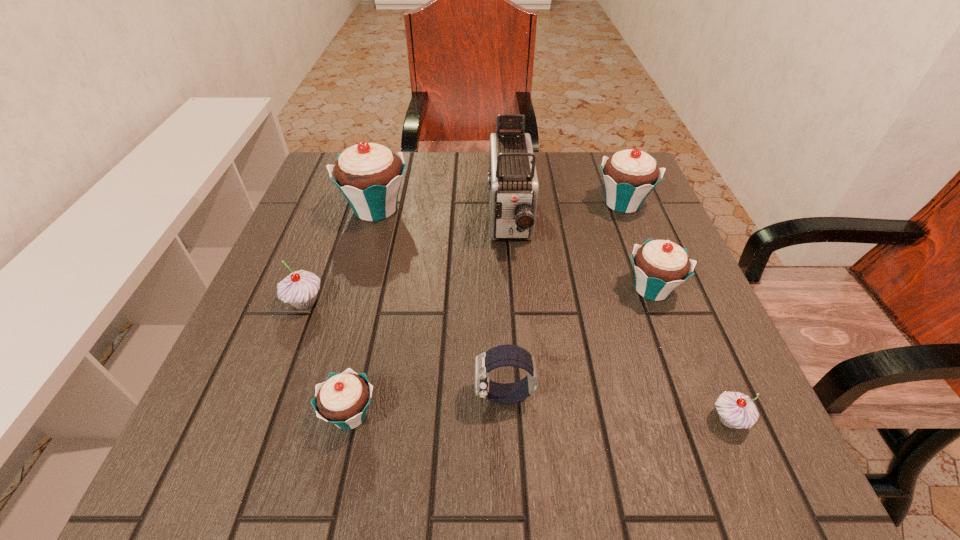
The width and height of the screenshot is (960, 540). What are the coordinates of `vacant space located 0.050m on the left of the right gray cupcake` in the screenshot? It's located at (677, 420).

Find the location of a particular element. This screenshot has height=540, width=960. free space located 0.150m on the left of the nearest teal cupcake is located at coordinates (226, 415).

Locate an element on the screen. This screenshot has width=960, height=540. camcorder that is at the far edge is located at coordinates (513, 187).

The width and height of the screenshot is (960, 540). Identify the location of object located in the far left corner section of the desktop. (369, 175).

The width and height of the screenshot is (960, 540). What are the coordinates of `object positioned at the far right corner` in the screenshot? It's located at (629, 176).

Identify the location of object present at the near right corner. Image resolution: width=960 pixels, height=540 pixels. (736, 410).

Find the location of a particular element. blank area at the far edge is located at coordinates (551, 152).

Where is `vacant space at the left edge of the desktop`? The height and width of the screenshot is (540, 960). vacant space at the left edge of the desktop is located at coordinates (274, 343).

In the image, there is a desktop. Find the location of `vacant space at the right edge`. vacant space at the right edge is located at coordinates (631, 246).

Locate an element on the screen. This screenshot has height=540, width=960. vacant point at the far left corner is located at coordinates (318, 171).